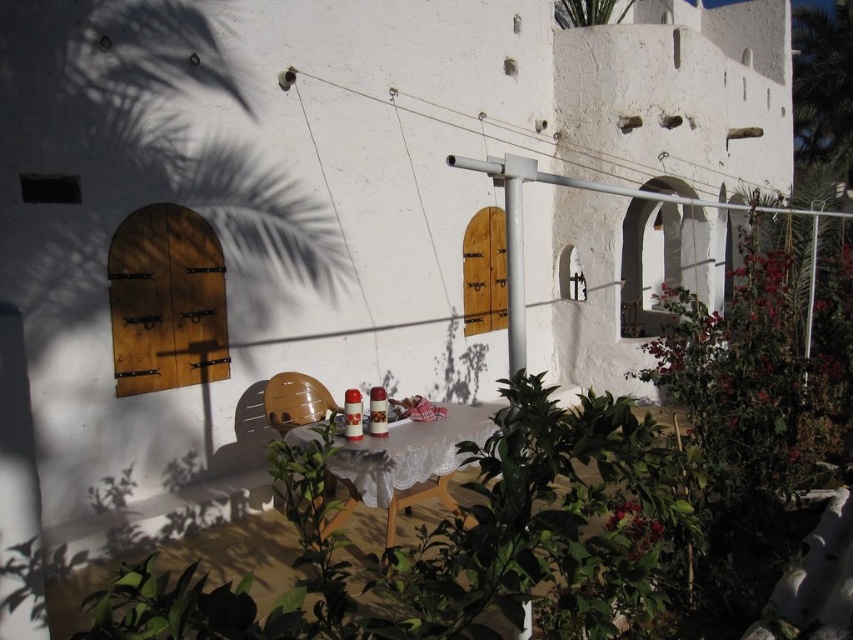
Question: In this image, where is white lace tablecloth at center located relative to green leafy plant at upper center?

Choices:
 (A) right
 (B) left

Answer: (B)

Question: Which point is farther to the camera?

Choices:
 (A) (566, 3)
 (B) (367, 493)

Answer: (A)

Question: Is white lace tablecloth at center below green leafy plant at upper center?

Choices:
 (A) yes
 (B) no

Answer: (A)

Question: Observing the image, what is the correct spatial positioning of white lace tablecloth at center in reference to green leafy plant at upper center?

Choices:
 (A) left
 (B) right

Answer: (A)